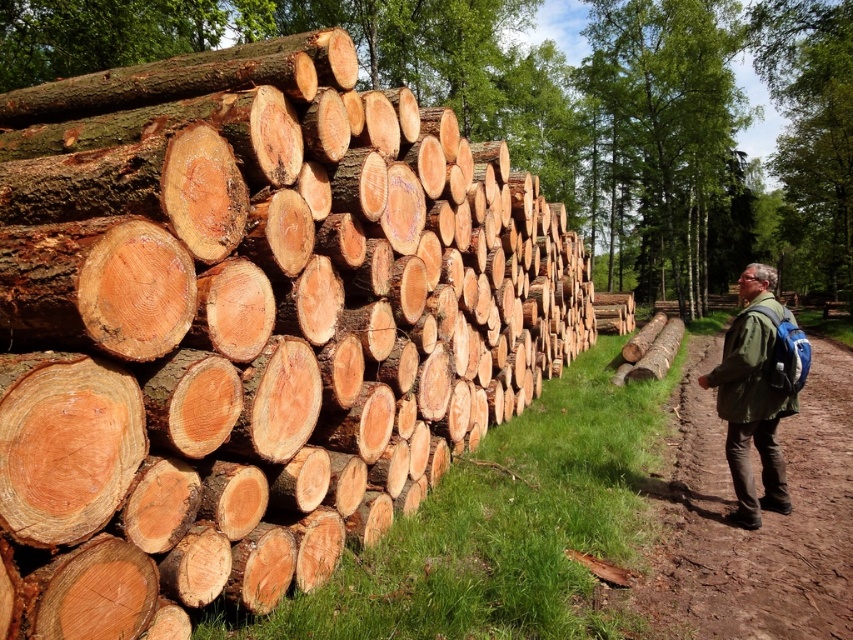
Can you confirm if natural wood logs at left is wider than brown dirt track at right?

Yes.

Is natural wood logs at left closer to the viewer compared to brown dirt track at right?

Yes, natural wood logs at left is in front of brown dirt track at right.

The width and height of the screenshot is (853, 640). Describe the element at coordinates (248, 324) in the screenshot. I see `natural wood logs at left` at that location.

The image size is (853, 640). Identify the location of natural wood logs at left. (248, 324).

Between point (717, 108) and point (750, 516), which one is positioned in front?

Positioned in front is point (750, 516).

Does green leafy tree at upper center have a smaller size compared to green fabric jacket at right?

No, green leafy tree at upper center is not smaller than green fabric jacket at right.

Who is more forward, [651,26] or [747,312]?

Point [747,312]

What are the coordinates of `green leafy tree at upper center` in the screenshot? It's located at click(672, 138).

Who is positioned more to the right, natural wood logs at left or green fabric jacket at right?

From the viewer's perspective, green fabric jacket at right appears more on the right side.

Between natural wood logs at left and green fabric jacket at right, which one is positioned lower?

Positioned lower is green fabric jacket at right.

Between point (254, 250) and point (726, 420), which one is positioned behind?

Positioned behind is point (726, 420).

You are a GUI agent. You are given a task and a screenshot of the screen. Output one action in this format:
    pyautogui.click(x=<x>, y=<y>)
    Task: Click on the natural wood logs at left
    Image resolution: width=853 pixels, height=640 pixels.
    Given the screenshot: What is the action you would take?
    pyautogui.click(x=248, y=324)